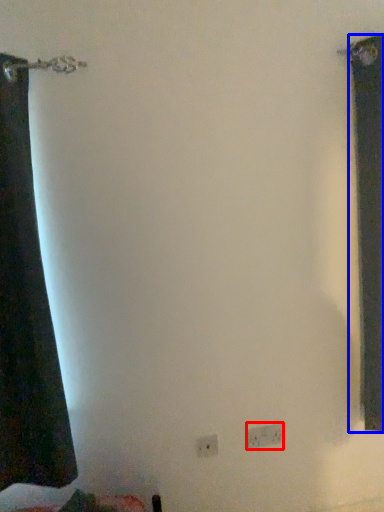
Question: Which object appears closest to the camera in this image, electric outlet (highlighted by a red box) or curtain (highlighted by a blue box)?

Choices:
 (A) electric outlet
 (B) curtain

Answer: (B)